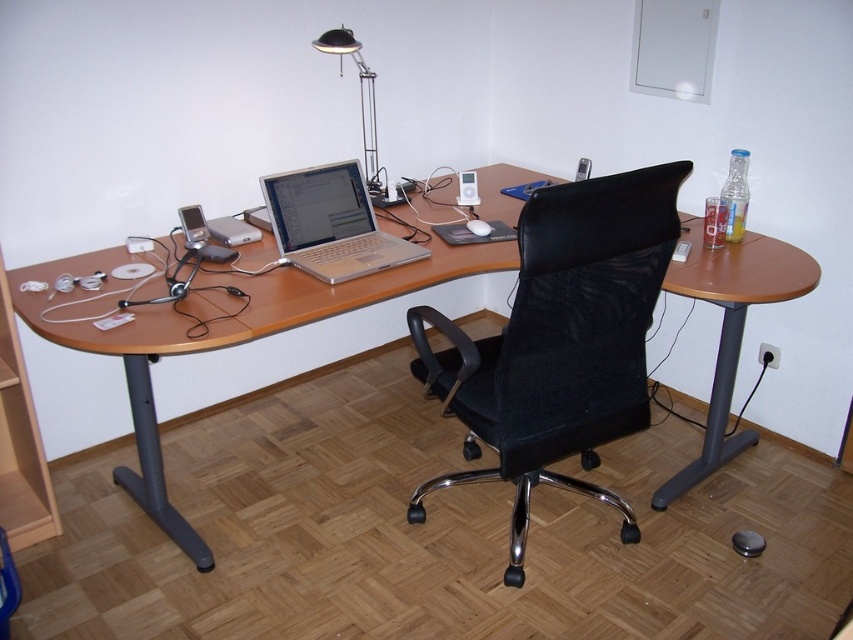
Does black mesh swivel chair at center appear on the right side of silver metallic laptop at center?

Yes, black mesh swivel chair at center is to the right of silver metallic laptop at center.

Does black mesh swivel chair at center have a greater height compared to silver metallic laptop at center?

Yes.

Locate an element on the screen. black mesh swivel chair at center is located at coordinates (561, 340).

Locate an element on the screen. The height and width of the screenshot is (640, 853). black mesh swivel chair at center is located at coordinates tap(561, 340).

Based on the photo, can you confirm if black mesh swivel chair at center is bigger than metallic silver desk lamp at upper center?

Indeed, black mesh swivel chair at center has a larger size compared to metallic silver desk lamp at upper center.

Does point (639, 387) come farther from viewer compared to point (372, 88)?

No, it is not.

The image size is (853, 640). Describe the element at coordinates (561, 340) in the screenshot. I see `black mesh swivel chair at center` at that location.

Where is `black mesh swivel chair at center`? black mesh swivel chair at center is located at coordinates (561, 340).

Does point (415, 260) lie behind point (364, 148)?

No, it is in front of (364, 148).

Looking at this image, is silver metallic laptop at center closer to camera compared to metallic silver desk lamp at upper center?

That is True.

This screenshot has width=853, height=640. I want to click on silver metallic laptop at center, so click(x=331, y=224).